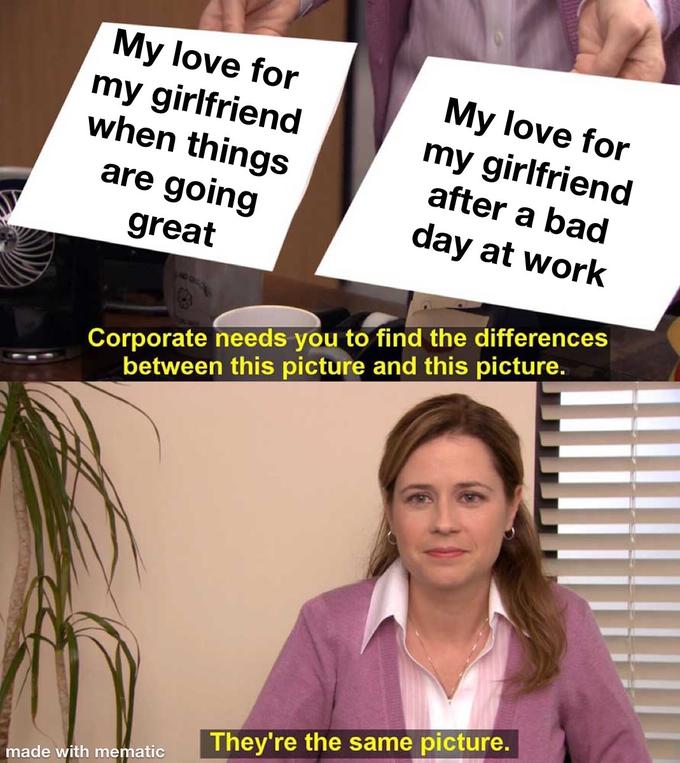
What are the coordinates of `fan` in the screenshot? It's located at (24, 253).